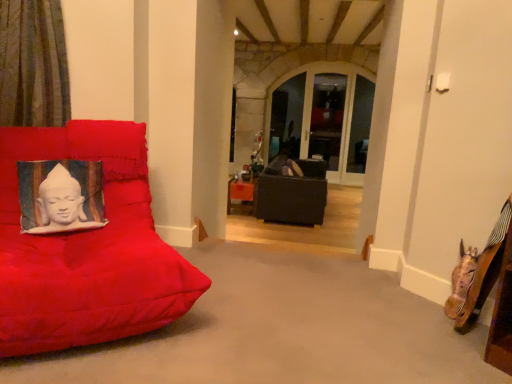
Question: From a real-world perspective, is matte black couch at center, which is the first furniture from right to left, under silk cushion with buddha print at left?

Choices:
 (A) yes
 (B) no

Answer: (A)

Question: Is matte black couch at center, acting as the 2th furniture starting from the front, wider than silk cushion with buddha print at left?

Choices:
 (A) yes
 (B) no

Answer: (A)

Question: Does matte black couch at center, marked as the 2th furniture in a left-to-right arrangement, lie in front of silk cushion with buddha print at left?

Choices:
 (A) yes
 (B) no

Answer: (B)

Question: Is matte black couch at center, marked as the 2th furniture in a left-to-right arrangement, outside silk cushion with buddha print at left?

Choices:
 (A) yes
 (B) no

Answer: (A)

Question: Considering the relative positions of matte black couch at center, which is the first furniture from right to left, and silk cushion with buddha print at left in the image provided, is matte black couch at center, which is the first furniture from right to left, to the right of silk cushion with buddha print at left from the viewer's perspective?

Choices:
 (A) yes
 (B) no

Answer: (A)

Question: Does matte black couch at center, placed as the first furniture when sorted from back to front, come behind silk cushion with buddha print at left?

Choices:
 (A) yes
 (B) no

Answer: (A)

Question: Can you confirm if green striped curtain at left is wider than silk cushion with buddha print at left?

Choices:
 (A) yes
 (B) no

Answer: (A)

Question: Can you confirm if green striped curtain at left is thinner than silk cushion with buddha print at left?

Choices:
 (A) yes
 (B) no

Answer: (B)

Question: Can you confirm if green striped curtain at left is taller than silk cushion with buddha print at left?

Choices:
 (A) no
 (B) yes

Answer: (B)

Question: Can you confirm if green striped curtain at left is positioned to the left of silk cushion with buddha print at left?

Choices:
 (A) yes
 (B) no

Answer: (A)

Question: Is green striped curtain at left positioned before silk cushion with buddha print at left?

Choices:
 (A) yes
 (B) no

Answer: (A)

Question: Does green striped curtain at left touch silk cushion with buddha print at left?

Choices:
 (A) yes
 (B) no

Answer: (B)

Question: Is suede red cushion at left, acting as the 2th furniture starting from the right, positioned in front of matte black couch at center, marked as the 2th furniture in a left-to-right arrangement?

Choices:
 (A) no
 (B) yes

Answer: (B)